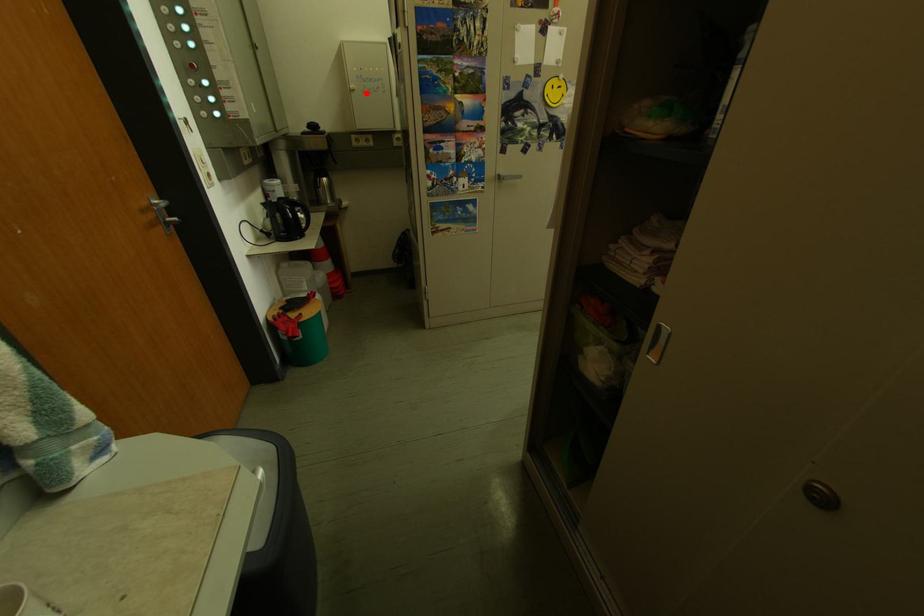
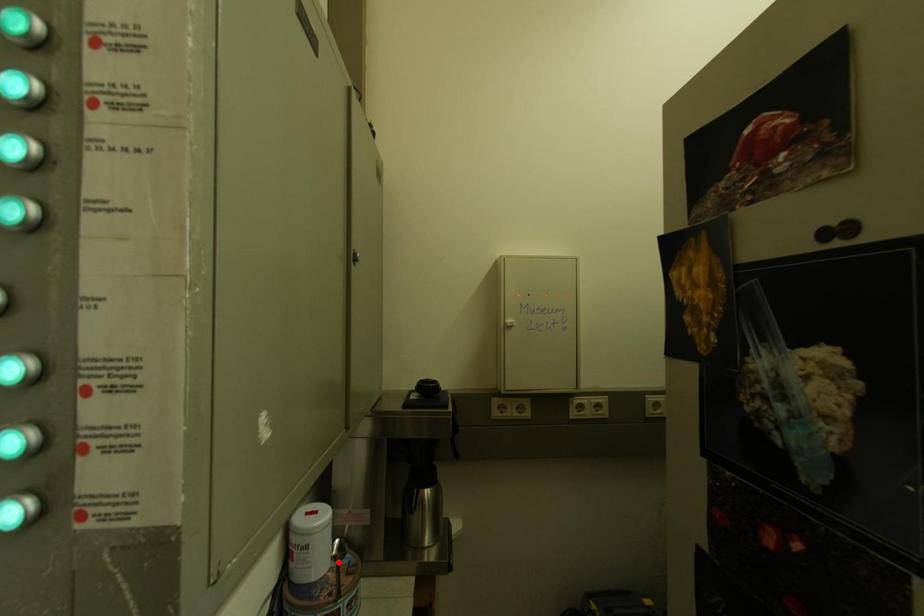
I am providing you with two images of the same scene from different viewpoints. A red point is marked on the first image and another point is marked on the second image. Do the highlighted points in image1 and image2 indicate the same real-world spot?

No